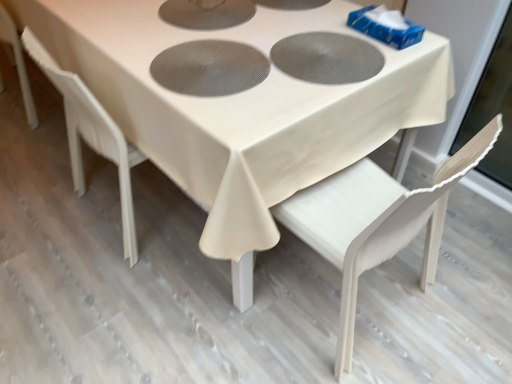
The width and height of the screenshot is (512, 384). I want to click on vacant region to the left of white plastic chair at lower left, arranged as the 2th chair when viewed from the right, so click(x=42, y=195).